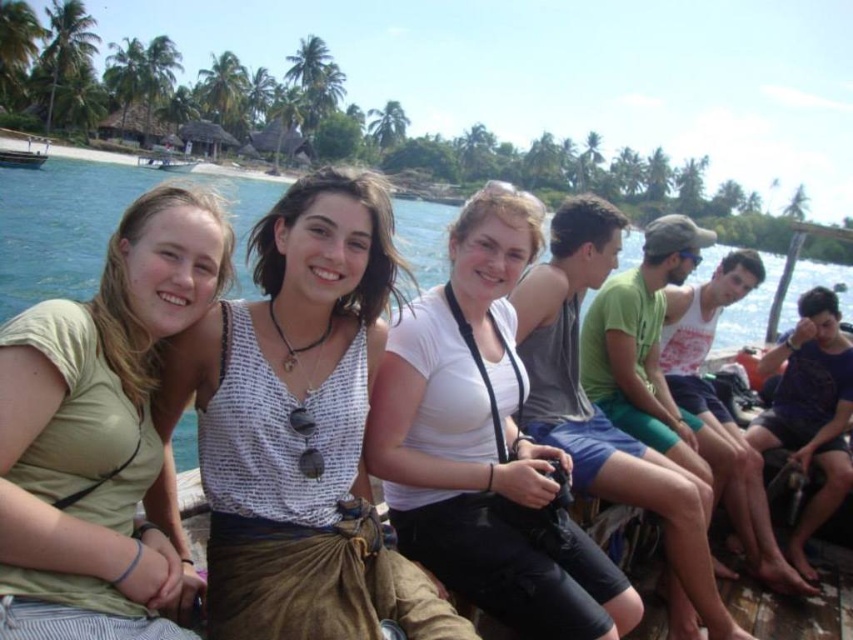
The height and width of the screenshot is (640, 853). What do you see at coordinates (297, 429) in the screenshot? I see `white printed tank top at center` at bounding box center [297, 429].

Does white printed tank top at center have a smaller size compared to white plastic boat at upper left?

Correct, white printed tank top at center occupies less space than white plastic boat at upper left.

Who is more distant from viewer, [271,522] or [154,164]?

The point [154,164] is behind.

Where is `white printed tank top at center`? white printed tank top at center is located at coordinates (297, 429).

Between point (91, 563) and point (149, 154), which one is positioned behind?

Point (149, 154)

Can you confirm if green matte shirt at left is taller than white plastic boat at upper left?

No, green matte shirt at left is not taller than white plastic boat at upper left.

The image size is (853, 640). Describe the element at coordinates (97, 429) in the screenshot. I see `green matte shirt at left` at that location.

This screenshot has height=640, width=853. Find the location of `green matte shirt at left`. green matte shirt at left is located at coordinates (97, 429).

Can you confirm if white printed tank top at center is positioned to the left of white matte shirt at center?

Yes, white printed tank top at center is to the left of white matte shirt at center.

Is white printed tank top at center further to camera compared to white matte shirt at center?

No, it is in front of white matte shirt at center.

Does point (227, 621) come farther from viewer compared to point (431, 518)?

No, it is not.

Identify the location of white printed tank top at center. (297, 429).